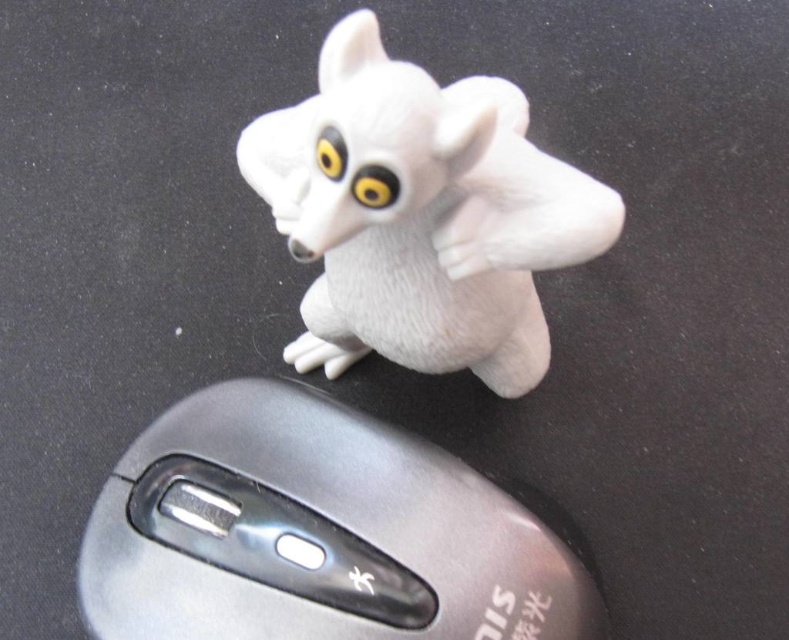
Question: Which point is farther to the camera?

Choices:
 (A) white matte/soft toy at center
 (B) black plastic mouse at lower left

Answer: (B)

Question: Does black plastic mouse at lower left have a smaller size compared to white matte/soft toy at center?

Choices:
 (A) no
 (B) yes

Answer: (B)

Question: Is black plastic mouse at lower left wider than white matte/soft toy at center?

Choices:
 (A) no
 (B) yes

Answer: (B)

Question: Is black plastic mouse at lower left to the left of white matte/soft toy at center from the viewer's perspective?

Choices:
 (A) yes
 (B) no

Answer: (A)

Question: Among these points, which one is farthest from the camera?

Choices:
 (A) (552, 202)
 (B) (320, 396)

Answer: (B)